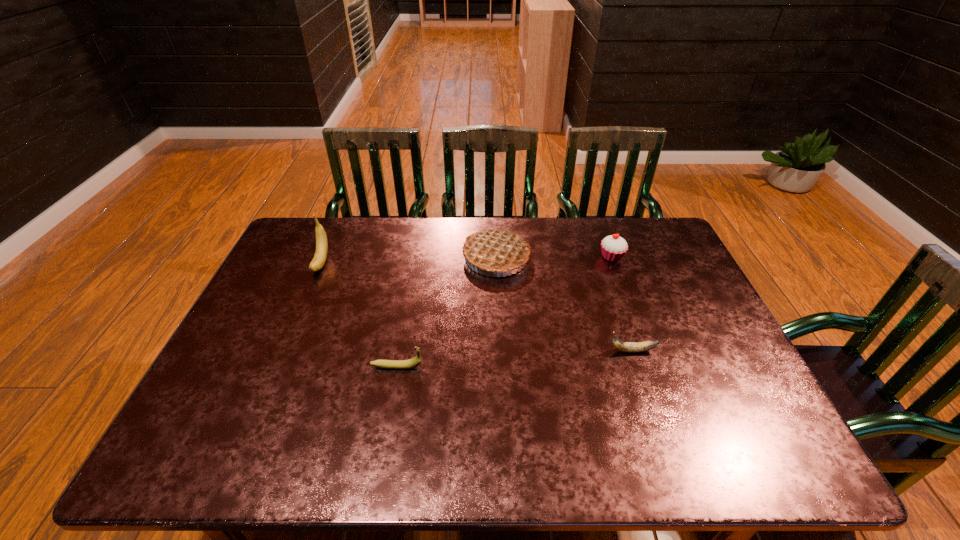
What are the coordinates of `empty space between the cupcake and the third object from right to left` in the screenshot? It's located at (554, 257).

Where is `unoccupied area between the pie and the second farthest banana`? This screenshot has height=540, width=960. unoccupied area between the pie and the second farthest banana is located at coordinates (564, 304).

Where is `free area in between the rightmost banana and the leftmost banana`? Image resolution: width=960 pixels, height=540 pixels. free area in between the rightmost banana and the leftmost banana is located at coordinates (477, 307).

At what (x,y) coordinates should I click in order to perform the action: click on empty space between the pie and the second farthest banana. Please return your answer as a coordinate pair (x, y). Looking at the image, I should click on 564,304.

Locate which object is the closest to the tallest banana. Please provide its 2D coordinates. Your answer should be formatted as a tuple, i.e. [(x, y)], where the tuple contains the x and y coordinates of a point satisfying the conditions above.

[(414, 362)]

Identify the location of object that is the third nearest to the second banana from left to right. (630, 347).

You are a GUI agent. You are given a task and a screenshot of the screen. Output one action in this format:
    pyautogui.click(x=<x>, y=<y>)
    Task: Click on the banana object that ranks as the third closest to the third object from right to left
    
    Given the screenshot: What is the action you would take?
    pyautogui.click(x=320, y=256)

Identify which banana is located as the second nearest to the nearest banana. Please provide its 2D coordinates. Your answer should be formatted as a tuple, i.e. [(x, y)], where the tuple contains the x and y coordinates of a point satisfying the conditions above.

[(630, 347)]

What are the coordinates of `vacant point that satisfies the following two spatial constraints: 1. on the back side of the cupcake; 2. on the right side of the third object from left to right` in the screenshot? It's located at (496, 257).